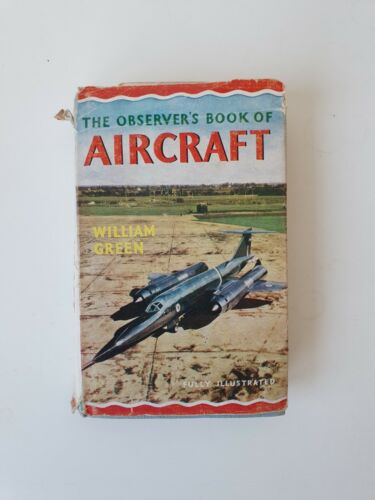
Find the location of a particular element. Image resolution: width=375 pixels, height=500 pixels. 1 book is located at coordinates (244, 341).